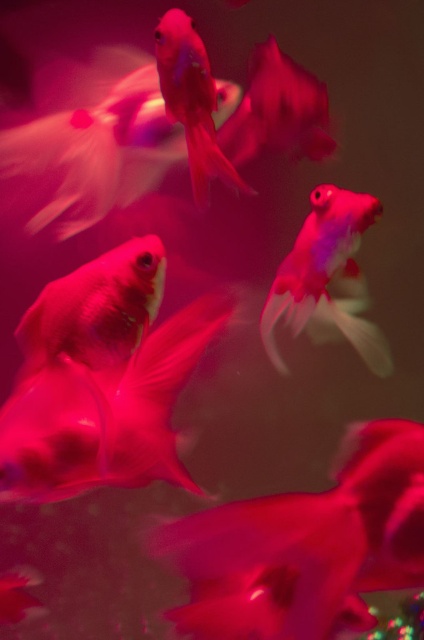
Question: Which point appears farthest from the camera in this image?

Choices:
 (A) [363, 333]
 (B) [265, 627]

Answer: (A)

Question: Which object is closer to the camera taking this photo?

Choices:
 (A) translucent pinkish-gold at center
 (B) matte pink goldfish at upper center
 (C) translucent pink goldfish at center

Answer: (A)

Question: Observing the image, what is the correct spatial positioning of translucent pinkish-gold at center in reference to translucent pink goldfish at center?

Choices:
 (A) right
 (B) left

Answer: (B)

Question: Is translucent pinkish-gold at center positioned in front of translucent pink goldfish at center?

Choices:
 (A) yes
 (B) no

Answer: (A)

Question: Which object appears closest to the camera in this image?

Choices:
 (A) translucent pinkish-gold at center
 (B) translucent pink goldfish at center
 (C) matte pink goldfish at upper center

Answer: (A)

Question: Can you confirm if translucent pinkish-gold at center is positioned to the left of translucent pink goldfish at center?

Choices:
 (A) yes
 (B) no

Answer: (A)